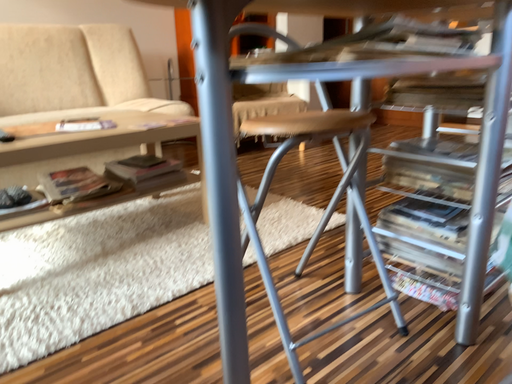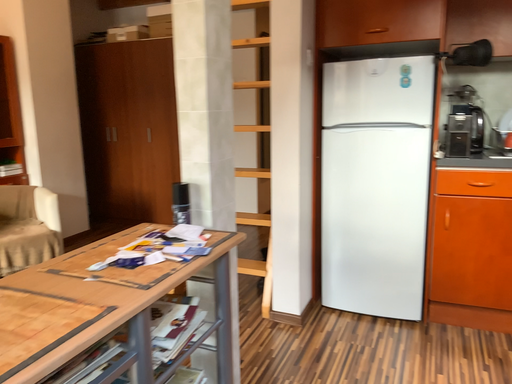
Question: How did the camera likely rotate when shooting the video?

Choices:
 (A) rotated downward
 (B) rotated upward

Answer: (B)